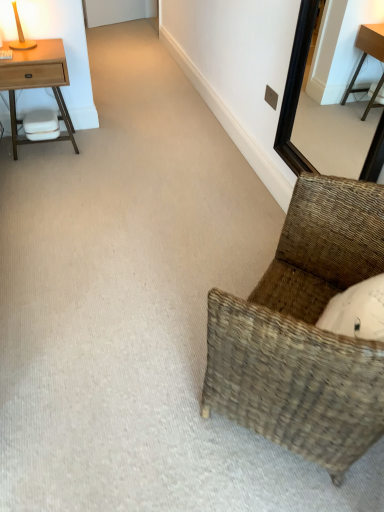
This screenshot has width=384, height=512. I want to click on matte wooden table lamp at upper left, so click(20, 34).

This screenshot has width=384, height=512. What do you see at coordinates (20, 34) in the screenshot? I see `matte wooden table lamp at upper left` at bounding box center [20, 34].

Where is `black wooden mirror at upper right`? This screenshot has width=384, height=512. black wooden mirror at upper right is located at coordinates (295, 90).

Identify the location of matte wooden table lamp at upper left. The width and height of the screenshot is (384, 512). (20, 34).

Which of these two, light wood nightstand at left or black wooden mirror at upper right, is bigger?

light wood nightstand at left is bigger.

Could you tell me if light wood nightstand at left is turned towards black wooden mirror at upper right?

No, light wood nightstand at left is not aimed at black wooden mirror at upper right.

Is point (62, 70) more distant than point (304, 27)?

That is True.

Is light wood nightstand at left positioned far away from matte wooden table lamp at upper left?

No, light wood nightstand at left is in close proximity to matte wooden table lamp at upper left.

In the scene shown: From the image's perspective, which one is positioned lower, light wood nightstand at left or matte wooden table lamp at upper left?

From the image's view, light wood nightstand at left is below.

Considering the relative sizes of light wood nightstand at left and matte wooden table lamp at upper left in the image provided, is light wood nightstand at left smaller than matte wooden table lamp at upper left?

Actually, light wood nightstand at left might be larger than matte wooden table lamp at upper left.

Could you tell me if black wooden mirror at upper right is facing light wood nightstand at left?

No, black wooden mirror at upper right does not turn towards light wood nightstand at left.

Identify the location of mirror located above the light wood nightstand at left (from a real-world perspective). The height and width of the screenshot is (512, 384). (295, 90).

Is black wooden mirror at upper right not inside light wood nightstand at left?

Yes, black wooden mirror at upper right is not within light wood nightstand at left.

Considering the relative positions of matte wooden table lamp at upper left and woven brown chair at lower right in the image provided, is matte wooden table lamp at upper left to the right of woven brown chair at lower right from the viewer's perspective?

Incorrect, matte wooden table lamp at upper left is not on the right side of woven brown chair at lower right.

From the image's perspective, which one is positioned lower, matte wooden table lamp at upper left or woven brown chair at lower right?

woven brown chair at lower right is shown below in the image.

Based on the photo, is matte wooden table lamp at upper left directly adjacent to woven brown chair at lower right?

No.

Locate an element on the screen. table lamp on the left of woven brown chair at lower right is located at coordinates (20, 34).

From a real-world perspective, is black wooden mirror at upper right above or below woven brown chair at lower right?

black wooden mirror at upper right is above woven brown chair at lower right.

Is black wooden mirror at upper right oriented towards woven brown chair at lower right?

No, black wooden mirror at upper right is not facing towards woven brown chair at lower right.

Between point (293, 78) and point (317, 182), which one is positioned behind?

The point (293, 78) is farther.

From the image's perspective, is black wooden mirror at upper right on top of woven brown chair at lower right?

Yes, from the image's perspective, black wooden mirror at upper right is on top of woven brown chair at lower right.

Locate an element on the screen. This screenshot has height=512, width=384. table lamp lying behind the black wooden mirror at upper right is located at coordinates (20, 34).

Between matte wooden table lamp at upper left and black wooden mirror at upper right, which one appears on the right side from the viewer's perspective?

From the viewer's perspective, black wooden mirror at upper right appears more on the right side.

Looking at this image, would you say matte wooden table lamp at upper left contains black wooden mirror at upper right?

No.

Considering the sizes of objects matte wooden table lamp at upper left and black wooden mirror at upper right in the image provided, who is smaller, matte wooden table lamp at upper left or black wooden mirror at upper right?

matte wooden table lamp at upper left.

How many degrees apart are the facing directions of woven brown chair at lower right and matte wooden table lamp at upper left?

The angular difference between woven brown chair at lower right and matte wooden table lamp at upper left is 137 degrees.

From the image's perspective, is woven brown chair at lower right above or below matte wooden table lamp at upper left?

From the image's perspective, woven brown chair at lower right appears below matte wooden table lamp at upper left.

Is point (271, 434) closer or farther from the camera than point (32, 42)?

Point (271, 434) is closer to the camera than point (32, 42).

Based on their positions, is woven brown chair at lower right located to the left or right of matte wooden table lamp at upper left?

woven brown chair at lower right is to the right of matte wooden table lamp at upper left.

Find the location of a particular element. The width and height of the screenshot is (384, 512). nightstand that is under the black wooden mirror at upper right (from a real-world perspective) is located at coordinates (37, 82).

What are the coordinates of `table lamp on the left of light wood nightstand at left` in the screenshot? It's located at (20, 34).

From the image, which object appears to be nearer to light wood nightstand at left, matte wooden table lamp at upper left or black wooden mirror at upper right?

matte wooden table lamp at upper left lies closer to light wood nightstand at left than the other object.

Estimate the real-world distances between objects in this image. Which object is closer to matte wooden table lamp at upper left, black wooden mirror at upper right or light wood nightstand at left?

light wood nightstand at left is closer to matte wooden table lamp at upper left.

Looking at the image, which one is located closer to matte wooden table lamp at upper left, light wood nightstand at left or black wooden mirror at upper right?

light wood nightstand at left is positioned closer to the anchor matte wooden table lamp at upper left.

Which object lies further to the anchor point black wooden mirror at upper right, matte wooden table lamp at upper left or light wood nightstand at left?

matte wooden table lamp at upper left.

Looking at the image, which one is located closer to light wood nightstand at left, matte wooden table lamp at upper left or woven brown chair at lower right?

Among the two, matte wooden table lamp at upper left is located nearer to light wood nightstand at left.

Looking at the image, which one is located further to light wood nightstand at left, black wooden mirror at upper right or matte wooden table lamp at upper left?

Based on the image, black wooden mirror at upper right appears to be further to light wood nightstand at left.

From the image, which object appears to be farther from woven brown chair at lower right, light wood nightstand at left or black wooden mirror at upper right?

light wood nightstand at left lies further to woven brown chair at lower right than the other object.

Looking at the image, which one is located closer to woven brown chair at lower right, matte wooden table lamp at upper left or light wood nightstand at left?

Among the two, light wood nightstand at left is located nearer to woven brown chair at lower right.

The height and width of the screenshot is (512, 384). Identify the location of chair between light wood nightstand at left and black wooden mirror at upper right. (304, 332).

The width and height of the screenshot is (384, 512). What are the coordinates of `nightstand located between matte wooden table lamp at upper left and black wooden mirror at upper right in the left-right direction` in the screenshot? It's located at (37, 82).

You are a GUI agent. You are given a task and a screenshot of the screen. Output one action in this format:
    pyautogui.click(x=<x>, y=<y>)
    Task: Click on the table lamp located between woven brown chair at lower right and light wood nightstand at left in the depth direction
    
    Given the screenshot: What is the action you would take?
    pyautogui.click(x=20, y=34)

Locate an element on the screen. This screenshot has width=384, height=512. chair between matte wooden table lamp at upper left and black wooden mirror at upper right from left to right is located at coordinates (304, 332).